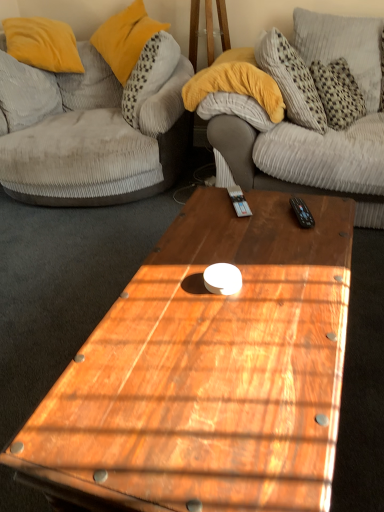
Question: From the image's perspective, is velvet grey couch at left positioned above or below black plastic remote control at upper right?

Choices:
 (A) above
 (B) below

Answer: (A)

Question: Considering the relative positions of velvet grey couch at left and black plastic remote control at upper right in the image provided, is velvet grey couch at left to the left or to the right of black plastic remote control at upper right?

Choices:
 (A) right
 (B) left

Answer: (B)

Question: Based on their relative distances, which object is nearer to the wooden coffee table at center?

Choices:
 (A) velvet grey couch at left
 (B) gray corduroy pillow at upper left, acting as the 1th pillow starting from the left
 (C) yellow velvet pillow at upper left, placed as the 2th pillow when sorted from left to right
 (D) black plastic remote control at upper right
 (E) gray corduroy pillow at upper right, the 1th pillow when ordered from right to left

Answer: (D)

Question: Based on their relative distances, which object is farther from the gray corduroy pillow at upper left, which is counted as the third pillow, starting from the right?

Choices:
 (A) gray corduroy pillow at upper right, the 1th pillow when ordered from right to left
 (B) yellow velvet pillow at upper left, placed as the 2th pillow when sorted from left to right
 (C) velvet grey couch at left
 (D) wooden coffee table at center
 (E) black plastic remote control at upper right

Answer: (E)